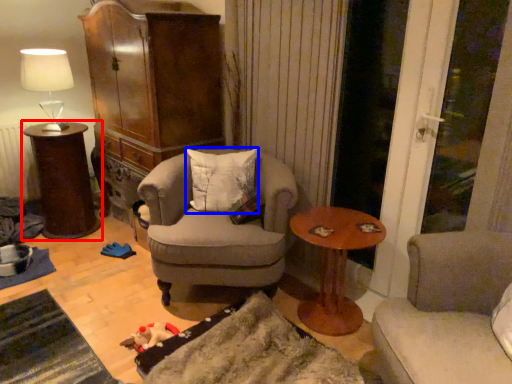
Question: Among these objects, which one is farthest to the camera, table (highlighted by a red box) or pillow (highlighted by a blue box)?

Choices:
 (A) table
 (B) pillow

Answer: (A)